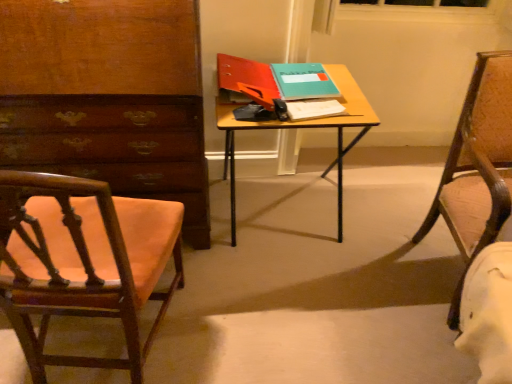
Question: Does wooden chair at left, marked as the 2th chair in a right-to-left arrangement, contain leather-like brown chair at right, the first chair from the right?

Choices:
 (A) no
 (B) yes

Answer: (A)

Question: Is wooden chair at left, acting as the first chair starting from the left, aimed at leather-like brown chair at right, which is the second chair from left to right?

Choices:
 (A) yes
 (B) no

Answer: (B)

Question: Considering the relative sizes of wooden chair at left, marked as the 2th chair in a right-to-left arrangement, and leather-like brown chair at right, the first chair from the right, in the image provided, is wooden chair at left, marked as the 2th chair in a right-to-left arrangement, shorter than leather-like brown chair at right, the first chair from the right,?

Choices:
 (A) no
 (B) yes

Answer: (B)

Question: From a real-world perspective, does wooden chair at left, acting as the first chair starting from the left, sit lower than leather-like brown chair at right, which is the second chair from left to right?

Choices:
 (A) yes
 (B) no

Answer: (A)

Question: Is wooden chair at left, marked as the 2th chair in a right-to-left arrangement, taller than leather-like brown chair at right, which is the second chair from left to right?

Choices:
 (A) yes
 (B) no

Answer: (B)

Question: From a real-world perspective, is wooden chair at left, marked as the 2th chair in a right-to-left arrangement, above or below leather-like brown chair at right, which is the second chair from left to right?

Choices:
 (A) below
 (B) above

Answer: (A)

Question: Is point (148, 216) positioned closer to the camera than point (486, 238)?

Choices:
 (A) farther
 (B) closer

Answer: (A)

Question: Is wooden chair at left, acting as the first chair starting from the left, bigger or smaller than leather-like brown chair at right, the first chair from the right?

Choices:
 (A) small
 (B) big

Answer: (A)

Question: From the image's perspective, relative to leather-like brown chair at right, which is the second chair from left to right, is wooden chair at left, marked as the 2th chair in a right-to-left arrangement, above or below?

Choices:
 (A) below
 (B) above

Answer: (A)

Question: From a real-world perspective, is wooden desk at center above or below white paper notepad at center?

Choices:
 (A) below
 (B) above

Answer: (A)

Question: In terms of height, does wooden desk at center look taller or shorter compared to white paper notepad at center?

Choices:
 (A) tall
 (B) short

Answer: (A)

Question: Considering their positions, is wooden desk at center located in front of or behind white paper notepad at center?

Choices:
 (A) front
 (B) behind

Answer: (A)

Question: Considering the positions of wooden desk at center and white paper notepad at center in the image, is wooden desk at center bigger or smaller than white paper notepad at center?

Choices:
 (A) small
 (B) big

Answer: (B)

Question: In terms of height, does white paper notepad at center look taller or shorter compared to leather-like brown chair at right, the first chair from the right?

Choices:
 (A) tall
 (B) short

Answer: (B)

Question: Looking at their shapes, would you say white paper notepad at center is wider or thinner than leather-like brown chair at right, the first chair from the right?

Choices:
 (A) thin
 (B) wide

Answer: (A)